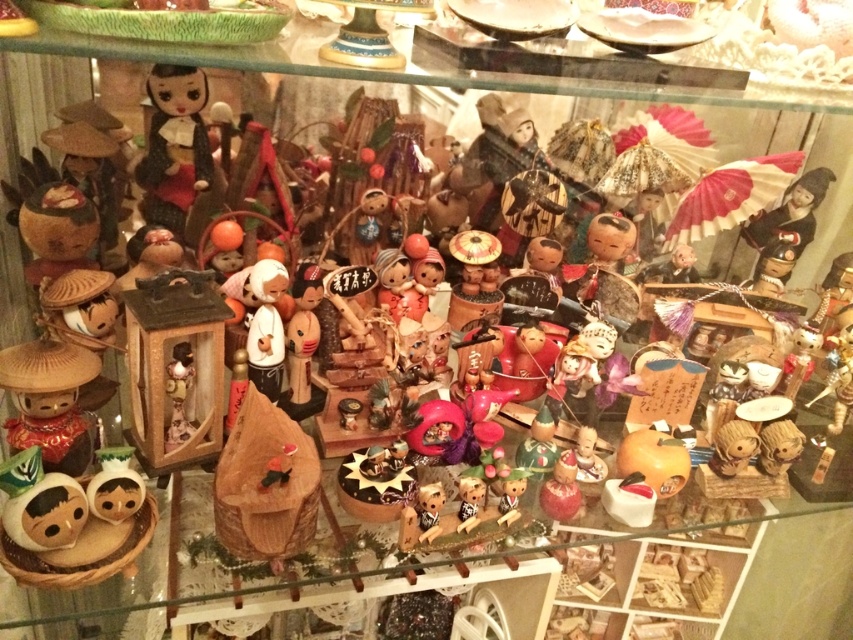
You are an art curator trying to place a new figurine in the glass cabinet. The existing arrangement has a matte brown figurine at left. Where should you place the new figurine to avoid overlapping with the existing one?

The matte brown figurine at left is located at point (49,401), so placing the new figurine in an area outside of this coordinate would prevent overlap.

Consider the image. You are an art curator arranging a new exhibit. You have a matte brown figurine at left and a shiny red lacquer bottle at center. Which object is located to the left of the other?

The matte brown figurine at left is positioned on the left side of the shiny red lacquer bottle at center.